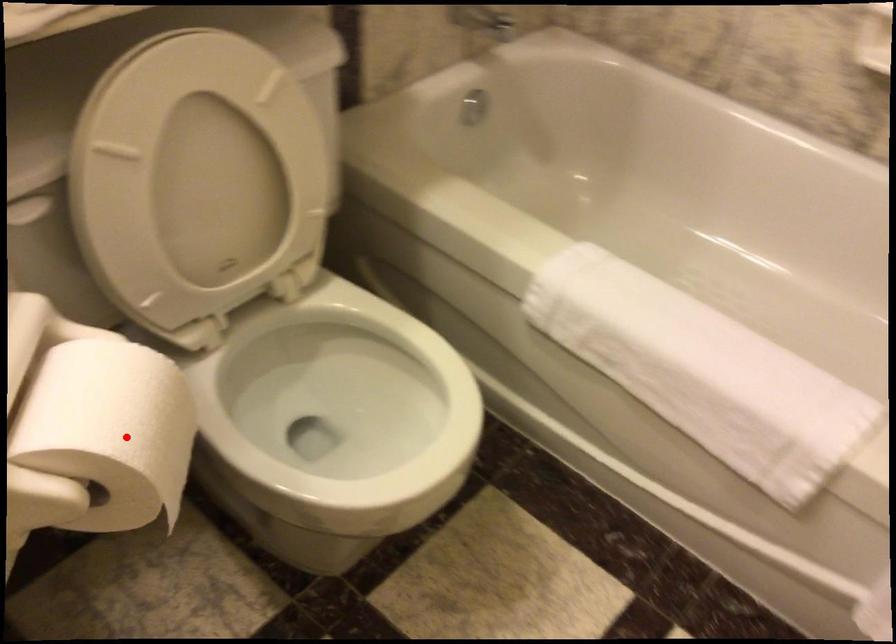
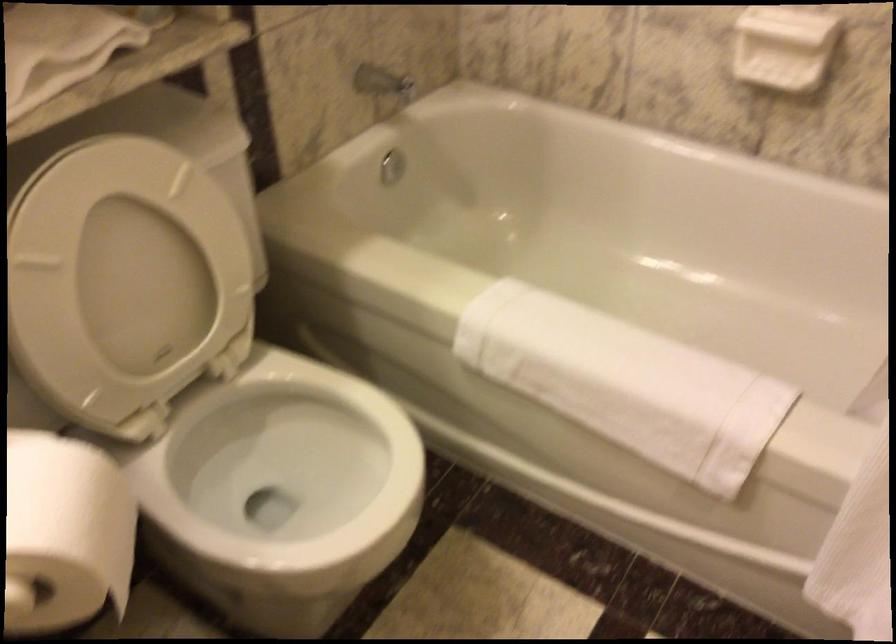
In the second image, find the point that corresponds to the highlighted location in the first image.

(64, 534)